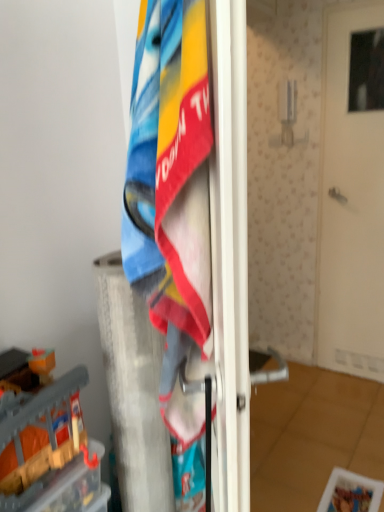
Where is `vacant area that is in front of white matte door at center`? The height and width of the screenshot is (512, 384). vacant area that is in front of white matte door at center is located at coordinates (354, 398).